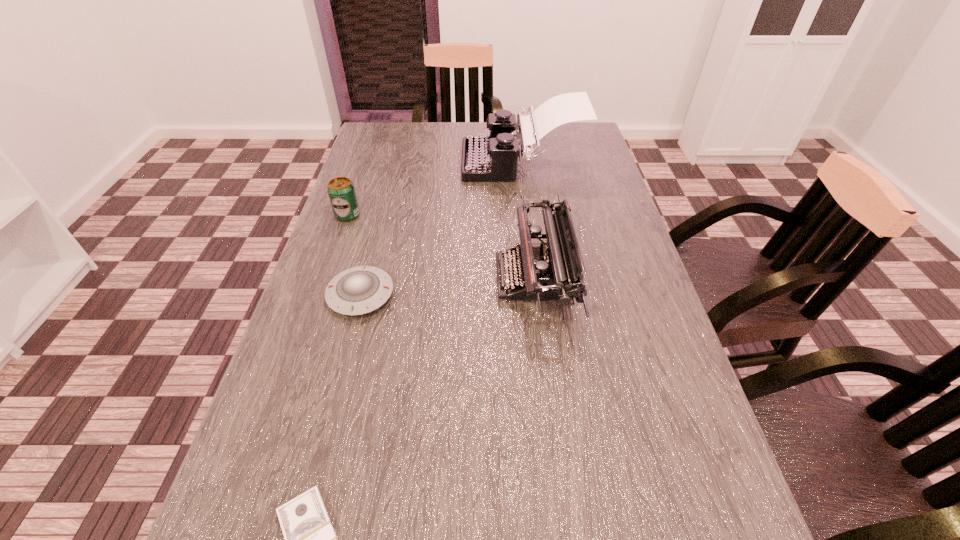
Where is `the taller typewriter`? The image size is (960, 540). the taller typewriter is located at coordinates (487, 158).

In order to click on the farther typewriter in this screenshot , I will do `click(487, 158)`.

Find the location of a particular element. The height and width of the screenshot is (540, 960). the second tallest object is located at coordinates (552, 271).

Locate an element on the screen. the shorter typewriter is located at coordinates (552, 271).

The height and width of the screenshot is (540, 960). I want to click on the third tallest object, so click(341, 191).

Where is `beer can`? This screenshot has height=540, width=960. beer can is located at coordinates (341, 191).

The height and width of the screenshot is (540, 960). I want to click on the second shortest object, so click(x=359, y=290).

Where is `vacant space located 0.230m on the keys of the farther typewriter`? The width and height of the screenshot is (960, 540). vacant space located 0.230m on the keys of the farther typewriter is located at coordinates (388, 161).

The height and width of the screenshot is (540, 960). Find the location of `free region located on the keys of the farther typewriter`. free region located on the keys of the farther typewriter is located at coordinates (433, 161).

Identify the location of free space located 0.070m on the keys of the farther typewriter. (440, 161).